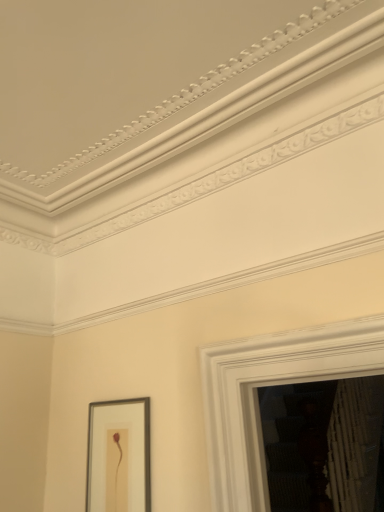
You are a GUI agent. You are given a task and a screenshot of the screen. Output one action in this format:
    pyautogui.click(x=<x>, y=<y>)
    Task: Click on the matte black picture frame at lower left
    This screenshot has width=384, height=512.
    Given the screenshot: What is the action you would take?
    pyautogui.click(x=119, y=456)

What do you see at coordinates (119, 456) in the screenshot? I see `matte black picture frame at lower left` at bounding box center [119, 456].

Where is `matte black picture frame at lower left`? The width and height of the screenshot is (384, 512). matte black picture frame at lower left is located at coordinates (119, 456).